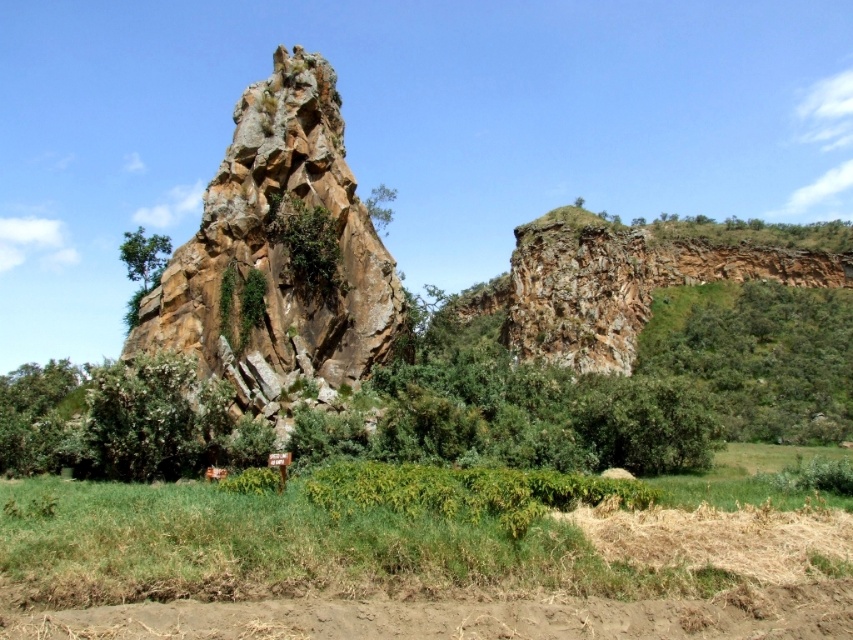
Question: Considering the real-world distances, which object is closest to the green leafy shrub at upper right?

Choices:
 (A) brown rough rock at center
 (B) green leafy tree at upper center

Answer: (B)

Question: Is brown rough rock at center above green leafy tree at upper center?

Choices:
 (A) no
 (B) yes

Answer: (A)

Question: Considering the relative positions of brown rough rock at center and green leafy shrub at upper right in the image provided, where is brown rough rock at center located with respect to green leafy shrub at upper right?

Choices:
 (A) below
 (B) above

Answer: (B)

Question: Does green leafy shrub at upper right appear over green leafy tree at upper center?

Choices:
 (A) no
 (B) yes

Answer: (A)

Question: Which of the following is the farthest from the observer?

Choices:
 (A) green leafy shrub at upper right
 (B) brown rough rock at center
 (C) green leafy tree at upper left
 (D) green leafy tree at upper center

Answer: (A)

Question: Considering the real-world distances, which object is farthest from the brown rough rock at center?

Choices:
 (A) green leafy shrub at upper right
 (B) green leafy tree at upper left
 (C) green leafy tree at upper center

Answer: (A)